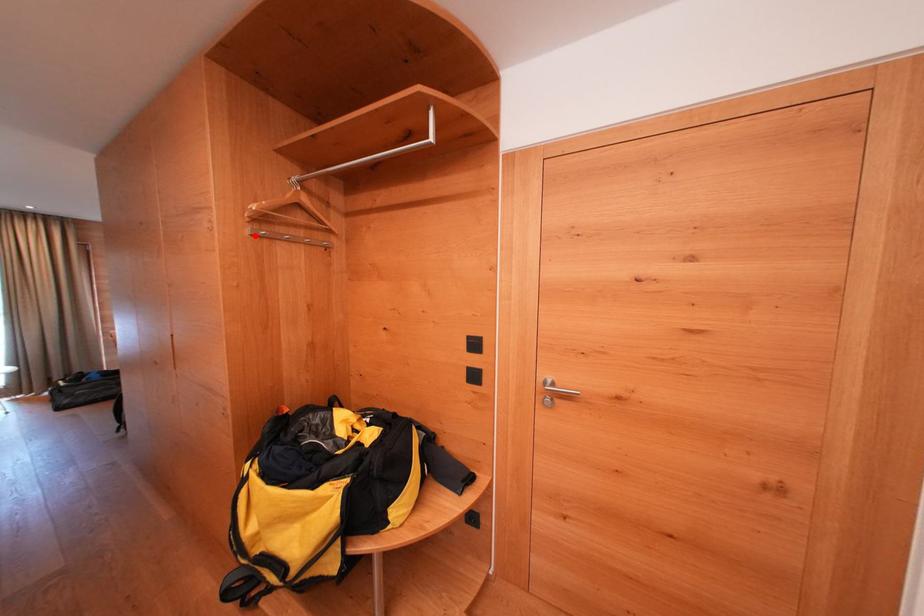
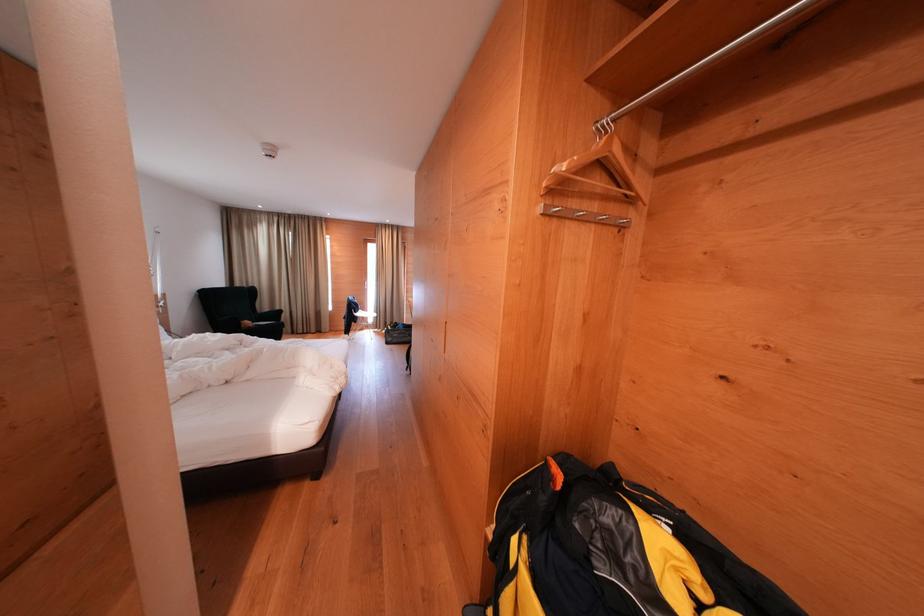
In the second image, find the point that corresponds to the highlighted location in the first image.

(546, 213)